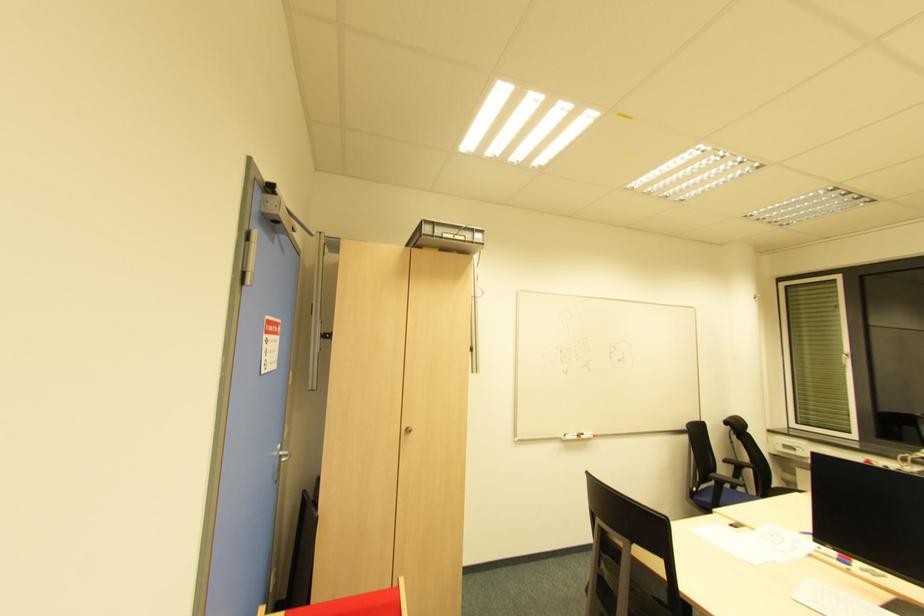
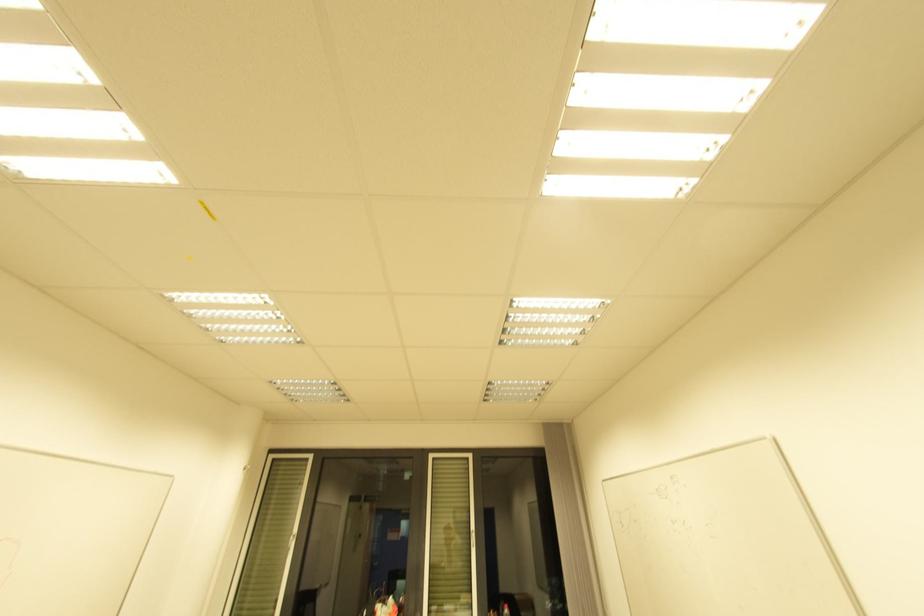
Where in the second image is the point corresponding to [847,357] from the first image?

(294, 538)